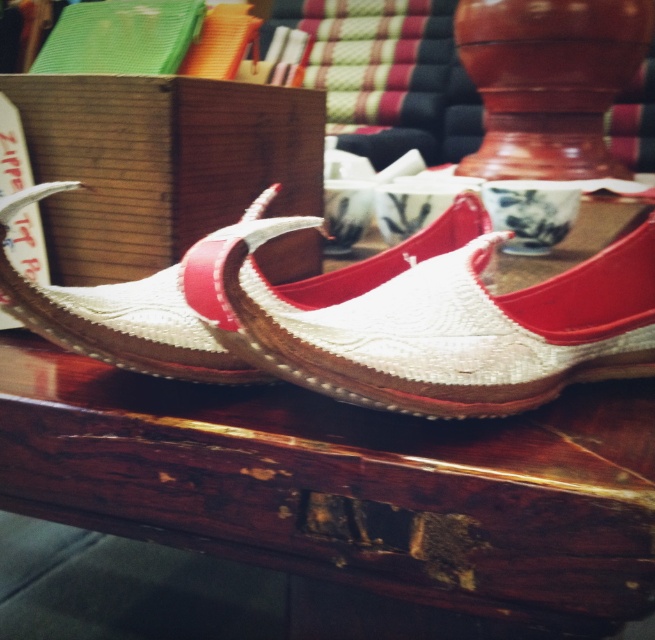
Does point (193, 435) come behind point (322, 323)?

Yes, point (193, 435) is farther from viewer.

Is point (633, 444) positioned in front of point (301, 336)?

No, (633, 444) is behind (301, 336).

Describe the element at coordinates (348, 484) in the screenshot. Image resolution: width=655 pixels, height=640 pixels. I see `wooden table at center` at that location.

This screenshot has width=655, height=640. Find the location of `wooden table at center`. wooden table at center is located at coordinates (348, 484).

Which is behind, point (295, 320) or point (92, 344)?

Point (92, 344)

Can you confirm if white woven sandal at center is smaller than woven fabric sandal at center?

No, white woven sandal at center is not smaller than woven fabric sandal at center.

Locate an element on the screen. white woven sandal at center is located at coordinates (430, 317).

Is point (365, 570) closer to viewer compared to point (81, 349)?

Yes, point (365, 570) is in front of point (81, 349).

Which is below, wooden table at center or woven fabric sandal at center?

Positioned lower is wooden table at center.

The height and width of the screenshot is (640, 655). In order to click on wooden table at center in this screenshot , I will do pyautogui.click(x=348, y=484).